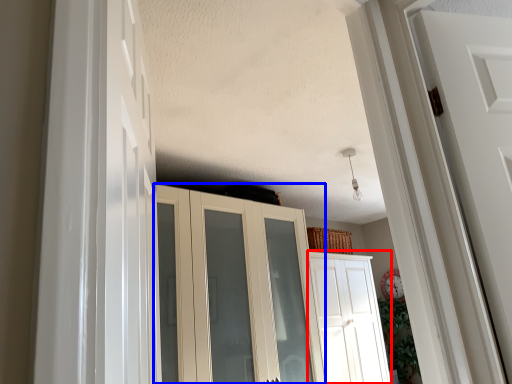
Question: Which object is closer to the camera taking this photo, door (highlighted by a red box) or cupboard (highlighted by a blue box)?

Choices:
 (A) door
 (B) cupboard

Answer: (B)